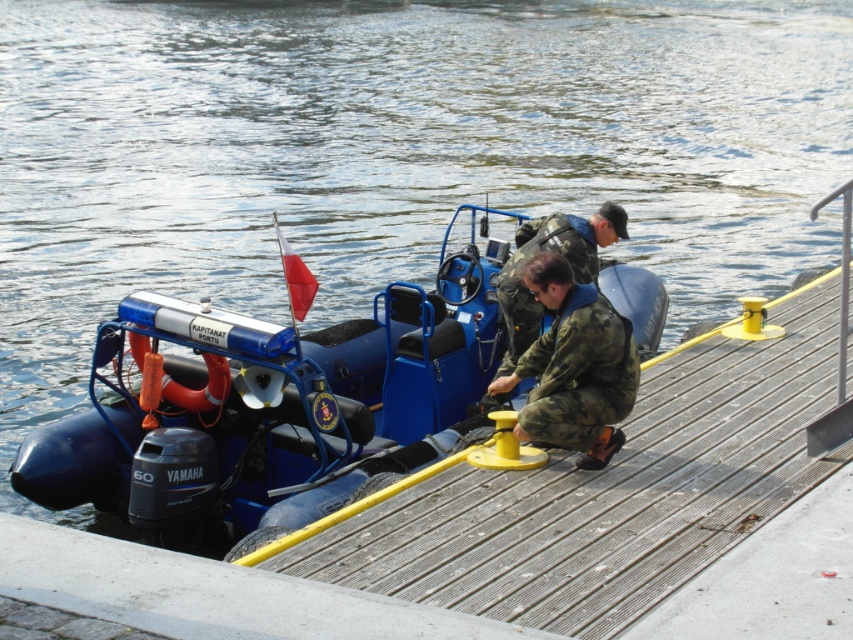
What object is located at the coordinate point (x=283, y=401) in the image?

The point (x=283, y=401) corresponds to the blue rubber boat at center.

You are a safety inspector checking the boat for compliance. According to the image, is the blue rubber boat at center positioned above or below the camo fabric uniform at center?

The blue rubber boat at center is taller than the camo fabric uniform at center, so the boat is positioned above the uniform.

You are a photographer trying to capture a clear photo of the blue rubber boat at center and the camo fabric uniform at center. Since you want both subjects to be visible in the frame, which object should you focus on first to ensure proper focus, considering their sizes?

The blue rubber boat at center is bigger than the camo fabric uniform at center, so you should focus on the blue rubber boat at center first to ensure proper focus since it takes up more space in the frame.